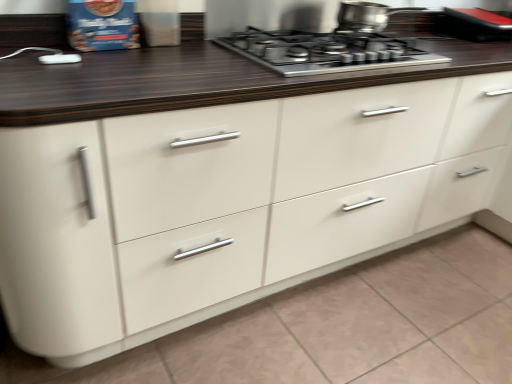
Question: From a real-world perspective, is stainless steel pot at upper center under black rubberized phone at upper right?

Choices:
 (A) yes
 (B) no

Answer: (B)

Question: Considering the relative sizes of stainless steel pot at upper center and black rubberized phone at upper right in the image provided, is stainless steel pot at upper center bigger than black rubberized phone at upper right?

Choices:
 (A) yes
 (B) no

Answer: (B)

Question: Can you confirm if stainless steel pot at upper center is thinner than black rubberized phone at upper right?

Choices:
 (A) yes
 (B) no

Answer: (A)

Question: Is stainless steel pot at upper center taller than black rubberized phone at upper right?

Choices:
 (A) yes
 (B) no

Answer: (B)

Question: Does stainless steel pot at upper center have a lesser height compared to black rubberized phone at upper right?

Choices:
 (A) no
 (B) yes

Answer: (B)

Question: In the image, is stainless steel pot at upper center positioned in front of or behind stainless steel gas stove at upper center?

Choices:
 (A) front
 (B) behind

Answer: (B)

Question: Considering the positions of stainless steel pot at upper center and stainless steel gas stove at upper center in the image, is stainless steel pot at upper center wider or thinner than stainless steel gas stove at upper center?

Choices:
 (A) wide
 (B) thin

Answer: (B)

Question: Is stainless steel pot at upper center to the left or to the right of stainless steel gas stove at upper center in the image?

Choices:
 (A) right
 (B) left

Answer: (A)

Question: From a real-world perspective, is stainless steel pot at upper center physically located above or below stainless steel gas stove at upper center?

Choices:
 (A) below
 (B) above

Answer: (B)

Question: From a real-world perspective, is stainless steel gas stove at upper center physically located above or below black rubberized phone at upper right?

Choices:
 (A) above
 (B) below

Answer: (B)

Question: Looking at their shapes, would you say stainless steel gas stove at upper center is wider or thinner than black rubberized phone at upper right?

Choices:
 (A) thin
 (B) wide

Answer: (B)

Question: Choose the correct answer: Is stainless steel gas stove at upper center inside black rubberized phone at upper right or outside it?

Choices:
 (A) outside
 (B) inside

Answer: (A)

Question: From the image's perspective, is stainless steel gas stove at upper center positioned above or below black rubberized phone at upper right?

Choices:
 (A) below
 (B) above

Answer: (A)

Question: Is stainless steel pot at upper center wider or thinner than black rubberized phone at upper right?

Choices:
 (A) thin
 (B) wide

Answer: (A)

Question: Considering the positions of stainless steel pot at upper center and black rubberized phone at upper right in the image, is stainless steel pot at upper center taller or shorter than black rubberized phone at upper right?

Choices:
 (A) tall
 (B) short

Answer: (B)